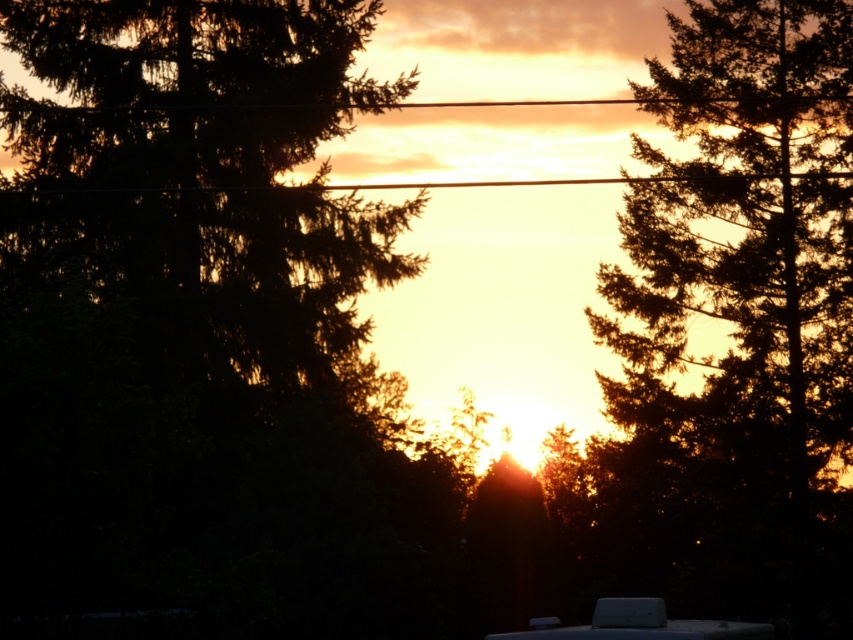
Question: Is dark green textured tree at right above white matte recreational vehicle at lower center?

Choices:
 (A) yes
 (B) no

Answer: (A)

Question: Does dark green textured tree at right have a lesser width compared to white matte recreational vehicle at lower center?

Choices:
 (A) no
 (B) yes

Answer: (B)

Question: Which point is closer to the camera taking this photo?

Choices:
 (A) (703, 584)
 (B) (724, 625)

Answer: (B)

Question: Which point is closer to the camera?

Choices:
 (A) dark green textured tree at right
 (B) white matte recreational vehicle at lower center

Answer: (B)

Question: Which object is farther from the camera taking this photo?

Choices:
 (A) dark green textured tree at right
 (B) white matte recreational vehicle at lower center

Answer: (A)

Question: Is dark green textured tree at right bigger than white matte recreational vehicle at lower center?

Choices:
 (A) yes
 (B) no

Answer: (B)